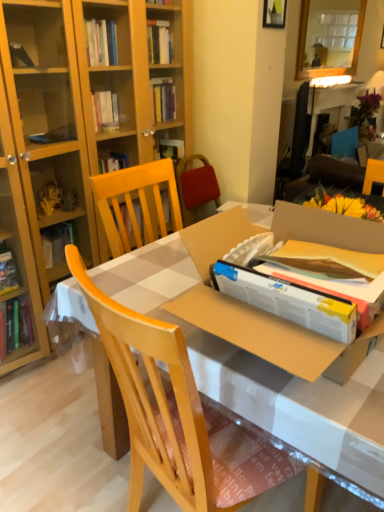
Locate an element on the screen. cardboard box at center is located at coordinates (258, 310).

At what (x,y) coordinates should I click in order to perform the action: click on light wood chair at center. Please return your answer as a coordinate pair (x, y). Looking at the image, I should click on (166, 408).

Find the location of a particular element. The height and width of the screenshot is (512, 384). wooden picture frame at upper center is located at coordinates (274, 13).

Which of these two, wooden picture frame at upper center or cardboard box at center, is bigger?

cardboard box at center.

Is wooden picture frame at upper center closer to camera compared to cardboard box at center?

That is False.

In the scene shown: From the image's perspective, who appears lower, wooden picture frame at upper center or cardboard box at center?

cardboard box at center.

Is point (285, 3) closer to viewer compared to point (203, 320)?

No, it is behind (203, 320).

Considering the positions of objects light wood chair at center and wooden picture frame at upper center in the image provided, who is more to the left, light wood chair at center or wooden picture frame at upper center?

Positioned to the left is light wood chair at center.

Does point (192, 400) appear closer or farther from the camera than point (280, 11)?

Point (192, 400).

Looking at this image, is light wood chair at center not inside wooden picture frame at upper center?

light wood chair at center lies outside wooden picture frame at upper center's area.

Are light wood chair at center and wooden picture frame at upper center making contact?

No, light wood chair at center is not with wooden picture frame at upper center.

Between cardboard box at center and glossy wooden mirror at upper center, which one appears on the left side from the viewer's perspective?

From the viewer's perspective, cardboard box at center appears more on the left side.

In terms of height, does cardboard box at center look taller or shorter compared to glossy wooden mirror at upper center?

Clearly, cardboard box at center is shorter compared to glossy wooden mirror at upper center.

Which object is wider, light wood chair at center or glossy wooden mirror at upper center?

light wood chair at center.

Is point (126, 408) behind point (312, 49)?

No, (126, 408) is closer to viewer.

Does light wood chair at center have a larger size compared to glossy wooden mirror at upper center?

Yes, light wood chair at center is bigger than glossy wooden mirror at upper center.

From the image's perspective, is glossy wooden mirror at upper center located above or below cardboard box at center?

Based on their image positions, glossy wooden mirror at upper center is located above cardboard box at center.

Is glossy wooden mirror at upper center not near cardboard box at center?

Yes, glossy wooden mirror at upper center and cardboard box at center are located far from each other.

Is glossy wooden mirror at upper center taller than cardboard box at center?

Yes, glossy wooden mirror at upper center is taller than cardboard box at center.

Considering the positions of objects glossy wooden mirror at upper center and cardboard box at center in the image provided, who is more to the left, glossy wooden mirror at upper center or cardboard box at center?

Positioned to the left is cardboard box at center.

Considering the sizes of objects light wood chair at center and cardboard box at center in the image provided, who is thinner, light wood chair at center or cardboard box at center?

With smaller width is light wood chair at center.

From the image's perspective, which is below, light wood chair at center or cardboard box at center?

light wood chair at center appears lower in the image.

Considering the positions of objects light wood chair at center and cardboard box at center in the image provided, who is more to the left, light wood chair at center or cardboard box at center?

From the viewer's perspective, light wood chair at center appears more on the left side.

Are light wood chair at center and cardboard box at center far apart?

No.

In order to click on chair below the glossy wooden mirror at upper center (from a real-world perspective) in this screenshot , I will do `click(166, 408)`.

Is glossy wooden mirror at upper center not near light wood chair at center?

Indeed, glossy wooden mirror at upper center is not near light wood chair at center.

Which is correct: glossy wooden mirror at upper center is inside light wood chair at center, or outside of it?

glossy wooden mirror at upper center is located beyond the bounds of light wood chair at center.

Locate an element on the screen. The image size is (384, 512). cardboard box below the wooden picture frame at upper center (from the image's perspective) is located at coordinates (258, 310).

This screenshot has width=384, height=512. I want to click on picture frame that is on the right side of light wood chair at center, so click(274, 13).

From the image, which object appears to be nearer to wooden picture frame at upper center, glossy wooden mirror at upper center or light wood chair at center?

The object closer to wooden picture frame at upper center is glossy wooden mirror at upper center.

Which object lies further to the anchor point cardboard box at center, wooden picture frame at upper center or light wood chair at center?

wooden picture frame at upper center lies further to cardboard box at center than the other object.

Estimate the real-world distances between objects in this image. Which object is closer to wooden picture frame at upper center, cardboard box at center or glossy wooden mirror at upper center?

glossy wooden mirror at upper center is positioned closer to the anchor wooden picture frame at upper center.

Which object lies nearer to the anchor point wooden picture frame at upper center, cardboard box at center or light wood chair at center?

Among the two, cardboard box at center is located nearer to wooden picture frame at upper center.

From the image, which object appears to be nearer to glossy wooden mirror at upper center, light wood chair at center or cardboard box at center?

The object closer to glossy wooden mirror at upper center is cardboard box at center.

Which object lies further to the anchor point cardboard box at center, light wood chair at center or glossy wooden mirror at upper center?

glossy wooden mirror at upper center.

Based on their spatial positions, is cardboard box at center or wooden picture frame at upper center closer to glossy wooden mirror at upper center?

Based on the image, wooden picture frame at upper center appears to be nearer to glossy wooden mirror at upper center.

Which object lies further to the anchor point glossy wooden mirror at upper center, light wood chair at center or wooden picture frame at upper center?

Based on the image, light wood chair at center appears to be further to glossy wooden mirror at upper center.

The height and width of the screenshot is (512, 384). Identify the location of cardboard box between light wood chair at center and wooden picture frame at upper center along the z-axis. (258, 310).

Locate an element on the screen. The height and width of the screenshot is (512, 384). picture frame between light wood chair at center and glossy wooden mirror at upper center in the front-back direction is located at coordinates (274, 13).

Identify the location of cardboard box located between light wood chair at center and glossy wooden mirror at upper center in the depth direction. The width and height of the screenshot is (384, 512). (258, 310).

Where is `picture frame located between cardboard box at center and glossy wooden mirror at upper center in the depth direction`? Image resolution: width=384 pixels, height=512 pixels. picture frame located between cardboard box at center and glossy wooden mirror at upper center in the depth direction is located at coordinates (274, 13).